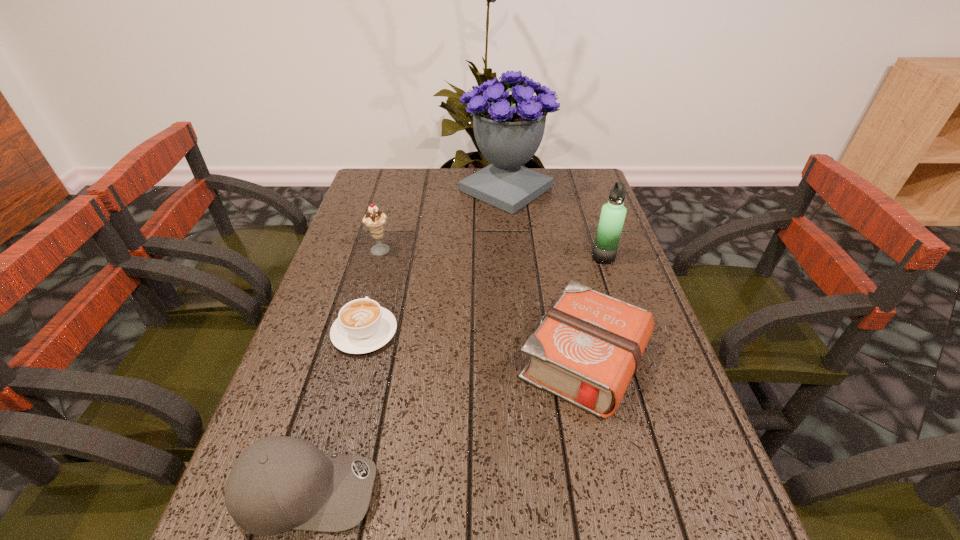
Image resolution: width=960 pixels, height=540 pixels. I want to click on vacant space that satisfies the following two spatial constraints: 1. on the front side of the fifth shortest object; 2. on the right side of the tallest object, so click(x=513, y=258).

In order to click on blank space that satisfies the following two spatial constraints: 1. on the side of the tallest object with the handle; 2. on the left side of the cappuccino in this screenshot , I will do `click(402, 189)`.